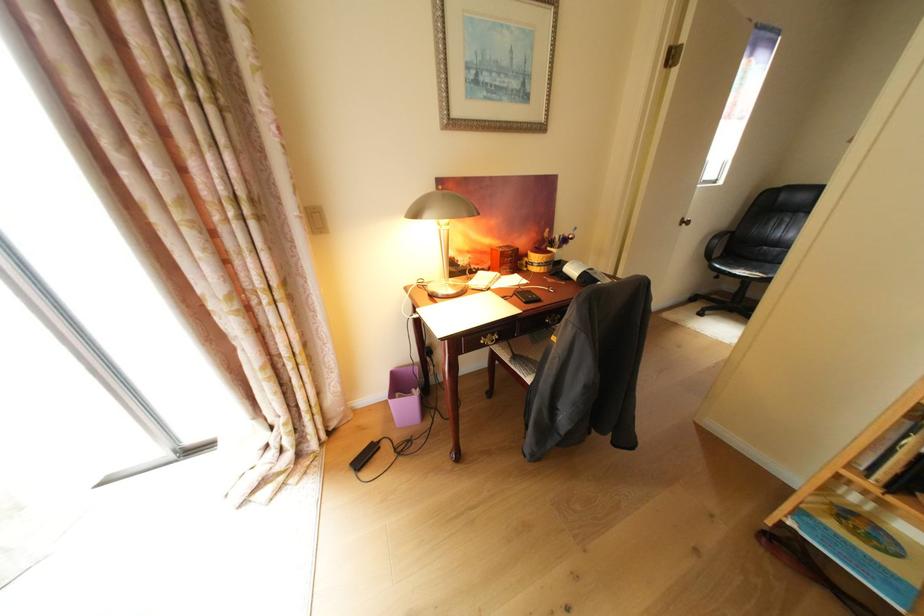
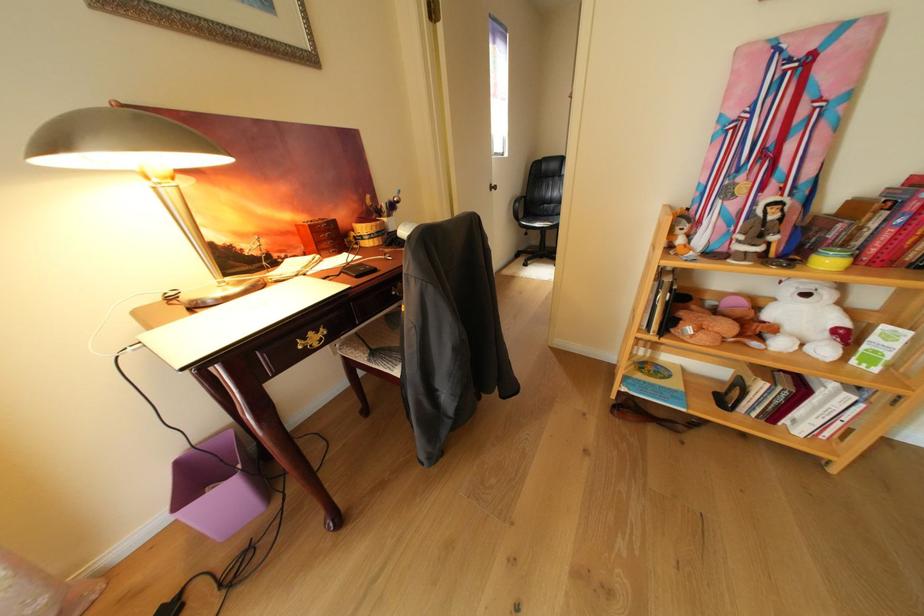
In the second image, find the point that corresponds to the point at 409,395 in the first image.

(221, 491)